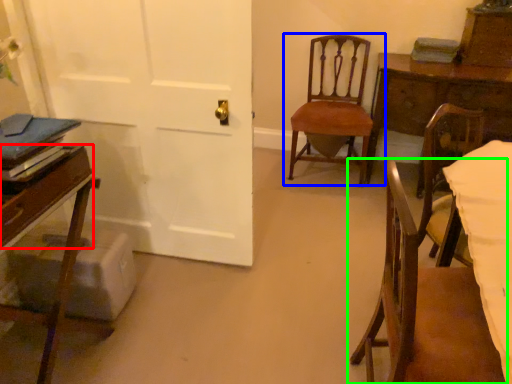
Question: Which object is the closest to the drawer (highlighted by a red box)? Choose among these: chair (highlighted by a blue box) or chair (highlighted by a green box).

Choices:
 (A) chair
 (B) chair

Answer: (B)